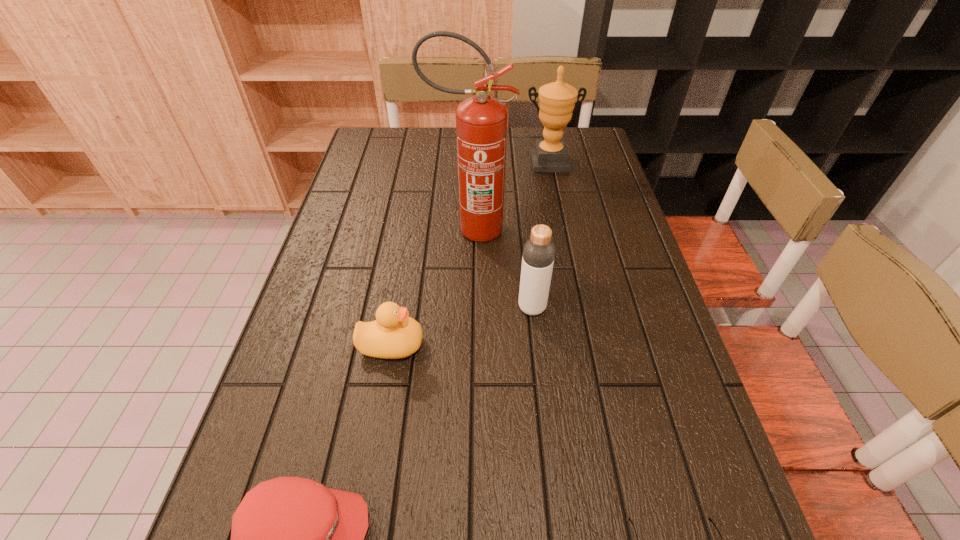
Find the location of a particular element. The height and width of the screenshot is (540, 960). vacant space that satisfies the following two spatial constraints: 1. at the front of the fifth shortest object with handles; 2. from the nozzle of the fifth nearest object is located at coordinates tap(563, 230).

This screenshot has width=960, height=540. Find the location of `free location that satisfies the following two spatial constraints: 1. at the front of the farthest object with handles; 2. on the face of the duck`. free location that satisfies the following two spatial constraints: 1. at the front of the farthest object with handles; 2. on the face of the duck is located at coordinates (586, 345).